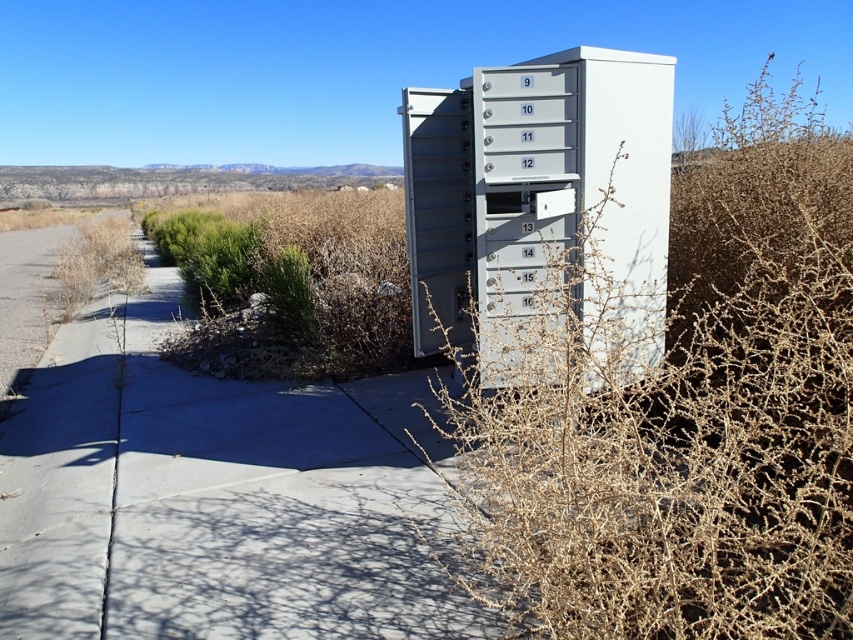
Which of these two, brown spiky bush at right or gray concrete sidewalk at center, stands shorter?

gray concrete sidewalk at center

In the scene shown: Does brown spiky bush at right appear on the left side of gray concrete sidewalk at center?

Incorrect, brown spiky bush at right is not on the left side of gray concrete sidewalk at center.

Where is `brown spiky bush at right`? This screenshot has height=640, width=853. brown spiky bush at right is located at coordinates (639, 349).

I want to click on brown spiky bush at right, so click(639, 349).

Who is higher up, gray concrete sidewalk at center or gray metallic file cabinet at center?

gray metallic file cabinet at center is higher up.

Looking at this image, who is more distant from viewer, [16,451] or [561,74]?

The point [16,451] is behind.

Where is `gray concrete sidewalk at center`? This screenshot has height=640, width=853. gray concrete sidewalk at center is located at coordinates 216,497.

Between point (524, 515) and point (480, 186), which one is positioned in front?

Positioned in front is point (524, 515).

Does point (665, 221) come closer to viewer compared to point (636, 108)?

No, it is behind (636, 108).

Between point (635, 236) and point (407, 113), which one is positioned behind?

Point (407, 113)

Locate an element on the screen. brown spiky bush at right is located at coordinates (639, 349).